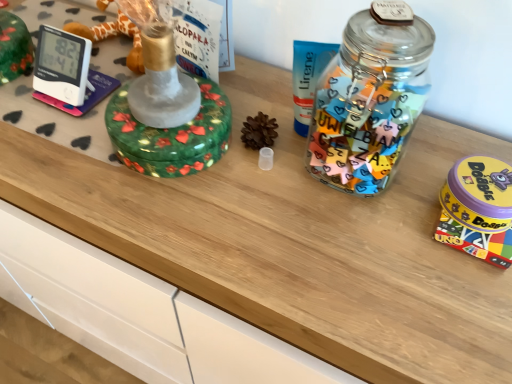
This screenshot has height=384, width=512. Find the location of `vacant space behind yellow plastic game at right, the 2th toy when ordered from left to right`. vacant space behind yellow plastic game at right, the 2th toy when ordered from left to right is located at coordinates (449, 141).